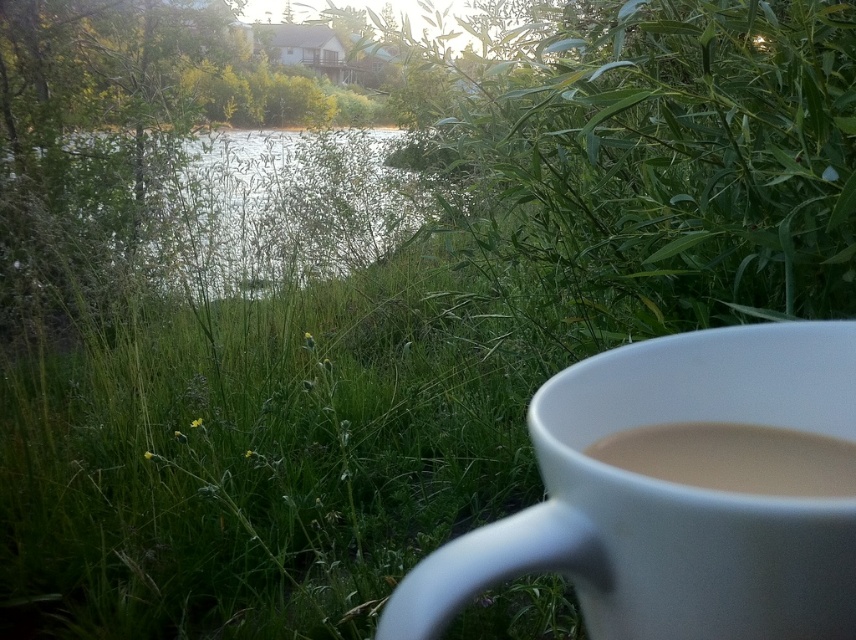
Which is below, white ceramic mug at lower right or green grassy river at center?

Positioned lower is white ceramic mug at lower right.

Is white ceramic mug at lower right bigger than green grassy river at center?

Incorrect, white ceramic mug at lower right is not larger than green grassy river at center.

Describe the element at coordinates (675, 488) in the screenshot. I see `white ceramic mug at lower right` at that location.

You are a GUI agent. You are given a task and a screenshot of the screen. Output one action in this format:
    pyautogui.click(x=<x>, y=<y>)
    Task: Click on the white ceramic mug at lower right
    The width and height of the screenshot is (856, 640).
    Given the screenshot: What is the action you would take?
    pyautogui.click(x=675, y=488)

Is the position of green grassy river at center more distant than that of white matte cup at lower right?

That is True.

What are the coordinates of `green grassy river at center` in the screenshot? It's located at (281, 209).

Does point (245, 256) come in front of point (801, 488)?

No, (245, 256) is further to viewer.

Identify the location of green grassy river at center. (281, 209).

Does white ceramic mug at lower right lie in front of white matte cup at lower right?

Yes, white ceramic mug at lower right is in front of white matte cup at lower right.

Who is positioned more to the left, white ceramic mug at lower right or white matte cup at lower right?

From the viewer's perspective, white ceramic mug at lower right appears more on the left side.

Who is more forward, (765,522) or (823,497)?

Point (765,522) is more forward.

This screenshot has width=856, height=640. Find the location of `white ceramic mug at lower right`. white ceramic mug at lower right is located at coordinates (675, 488).